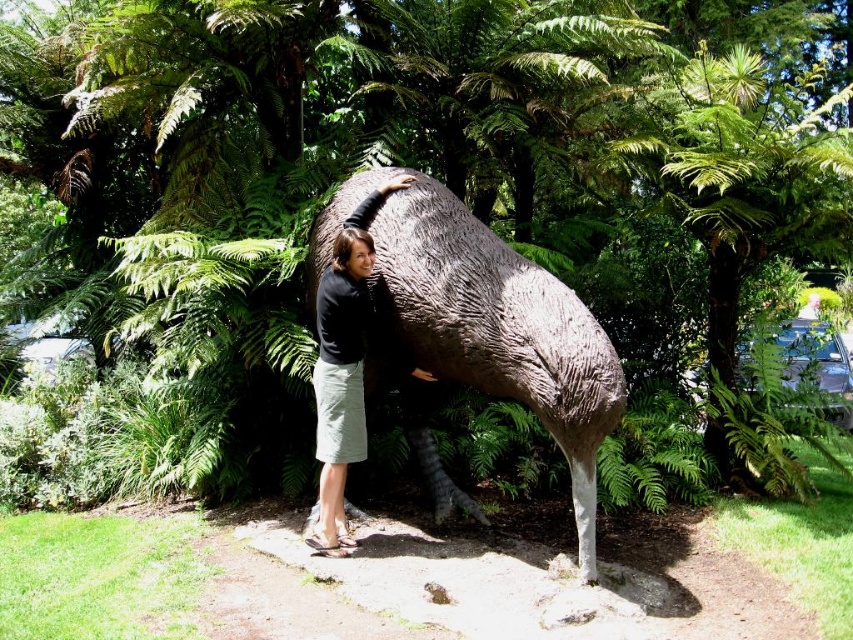
Question: Which point is farther from the camera taking this photo?

Choices:
 (A) 454,294
 (B) 364,273

Answer: (B)

Question: Is rough textured statue at center smaller than matte black shirt at center?

Choices:
 (A) no
 (B) yes

Answer: (A)

Question: Does rough textured statue at center have a greater width compared to matte black shirt at center?

Choices:
 (A) yes
 (B) no

Answer: (A)

Question: Does rough textured statue at center appear under matte black shirt at center?

Choices:
 (A) yes
 (B) no

Answer: (B)